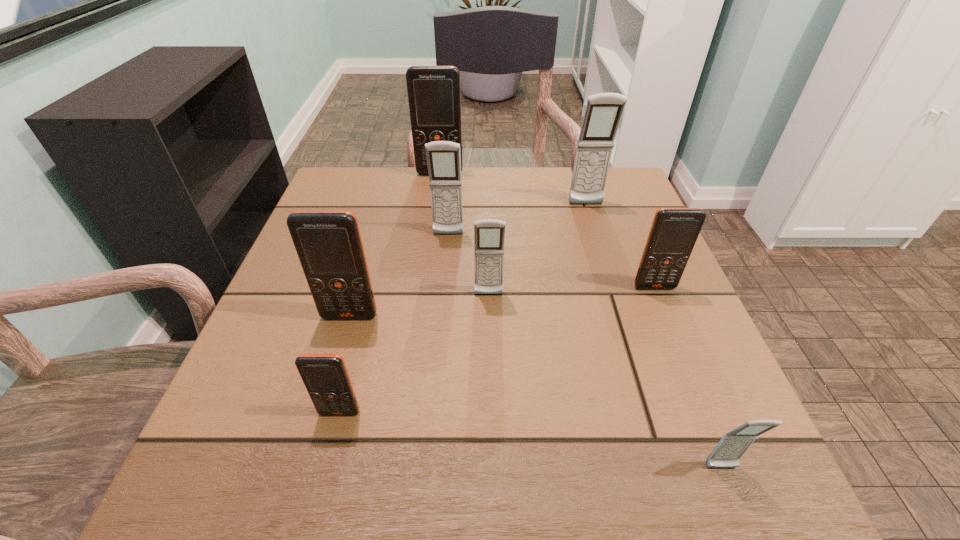
Where is `vacant position located on the front-facing side of the third gray cellular telephone from right to left`? This screenshot has height=540, width=960. vacant position located on the front-facing side of the third gray cellular telephone from right to left is located at coordinates (491, 376).

Where is `free space located on the screen of the second smallest orange cellular telephone`? free space located on the screen of the second smallest orange cellular telephone is located at coordinates (700, 397).

Locate an element on the screen. The image size is (960, 540). object that is at the near edge is located at coordinates (733, 445).

Locate an element on the screen. object that is at the far right corner is located at coordinates (603, 112).

You are a GUI agent. You are given a task and a screenshot of the screen. Output one action in this format:
    pyautogui.click(x=<x>, y=<y>)
    Task: Click on the object that is at the near right corner
    
    Given the screenshot: What is the action you would take?
    pyautogui.click(x=733, y=445)

Where is `vacant space at the far edge of the desktop`? The height and width of the screenshot is (540, 960). vacant space at the far edge of the desktop is located at coordinates (465, 208).

Locate an element on the screen. The height and width of the screenshot is (540, 960). vacant position at the near edge of the desktop is located at coordinates (331, 455).

This screenshot has height=540, width=960. In the image, there is a desktop. What are the coordinates of `blank space at the left edge` in the screenshot? It's located at (249, 351).

Identify the location of vacant space at the right edge of the desktop. Image resolution: width=960 pixels, height=540 pixels. (676, 301).

Image resolution: width=960 pixels, height=540 pixels. In order to click on blank space at the far left corner of the desktop in this screenshot , I will do `click(375, 214)`.